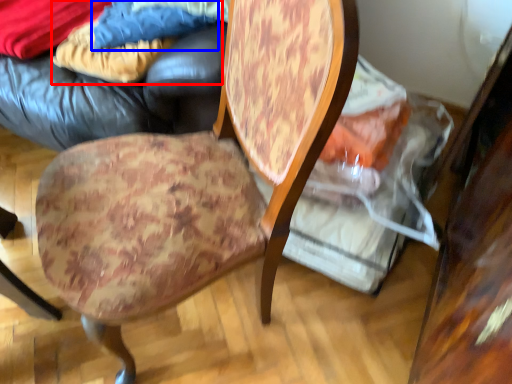
Question: Which point is further to the camera, fabric (highlighted by a red box) or fabric (highlighted by a blue box)?

Choices:
 (A) fabric
 (B) fabric

Answer: (A)